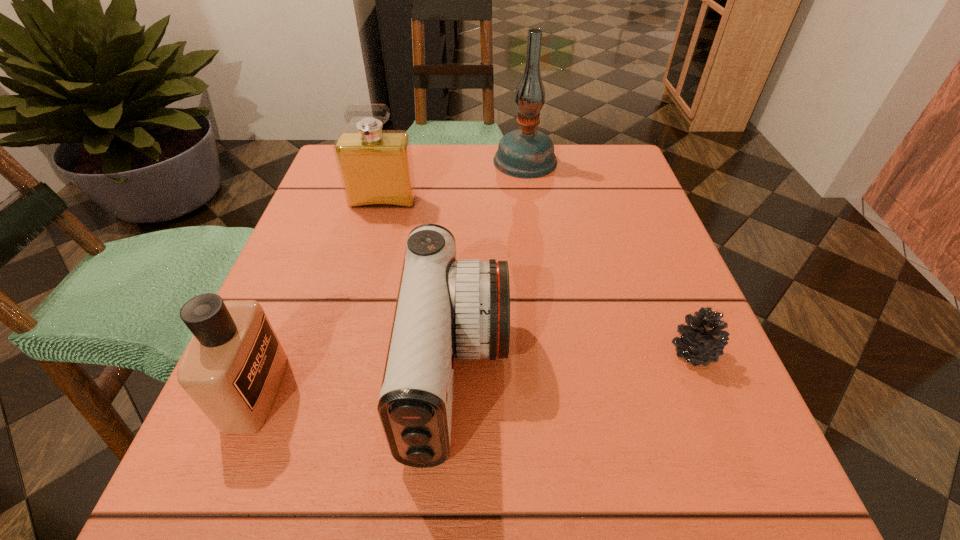
In order to click on free region at the near edge of the desktop in this screenshot , I will do `click(381, 504)`.

This screenshot has width=960, height=540. In order to click on vacant space at the left edge in this screenshot , I will do tap(324, 211).

In the image, there is a desktop. At what (x,y) coordinates should I click in order to perform the action: click on vacant space at the right edge. Please return your answer as a coordinate pair (x, y). This screenshot has height=540, width=960. Looking at the image, I should click on (661, 273).

In the image, there is a desktop. Identify the location of free space at the far right corner. (629, 168).

This screenshot has width=960, height=540. What are the coordinates of `free space between the camcorder and the shorter perfume` in the screenshot? It's located at (356, 383).

Where is `vacant space that's between the pinecone and the tallest object`? The width and height of the screenshot is (960, 540). vacant space that's between the pinecone and the tallest object is located at coordinates (610, 256).

Identify the location of vacant region between the tallest object and the fourth nearest object. This screenshot has width=960, height=540. (454, 181).

Where is `empty location between the camcorder and the rightmost object`? Image resolution: width=960 pixels, height=540 pixels. empty location between the camcorder and the rightmost object is located at coordinates (575, 363).

Identify the location of empty space that is in between the nearer perfume and the farthest object. (391, 275).

Where is `vacant region between the camcorder and the left perfume`? Image resolution: width=960 pixels, height=540 pixels. vacant region between the camcorder and the left perfume is located at coordinates (356, 383).